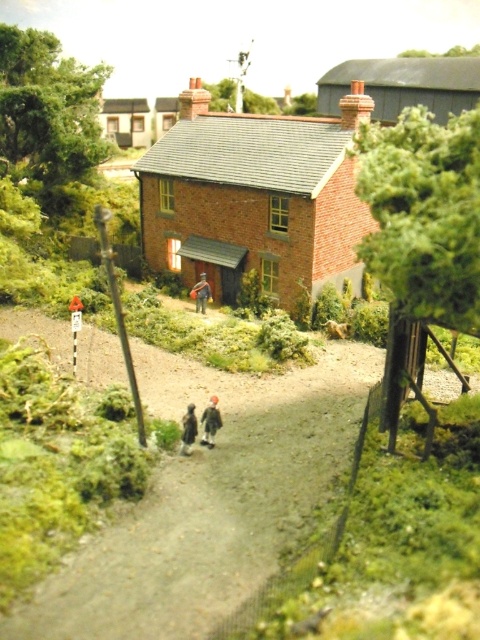
Question: Which object is the closest to the smooth brown figure at center?

Choices:
 (A) brown woolen coat at center
 (B) dark brown leather jacket at center

Answer: (A)

Question: Which of the following is the closest to the observer?

Choices:
 (A) smooth brown figure at center
 (B) brown woolen coat at center

Answer: (B)

Question: Among these objects, which one is nearest to the camera?

Choices:
 (A) smooth brown figure at center
 (B) dark brown leather jacket at center

Answer: (B)

Question: Is dark brown leather jacket at center below smooth brown figure at center?

Choices:
 (A) no
 (B) yes

Answer: (B)

Question: Observing the image, what is the correct spatial positioning of brown woolen coat at center in reference to smooth brown figure at center?

Choices:
 (A) above
 (B) below

Answer: (B)

Question: Does brown woolen coat at center have a larger size compared to dark brown leather jacket at center?

Choices:
 (A) no
 (B) yes

Answer: (A)